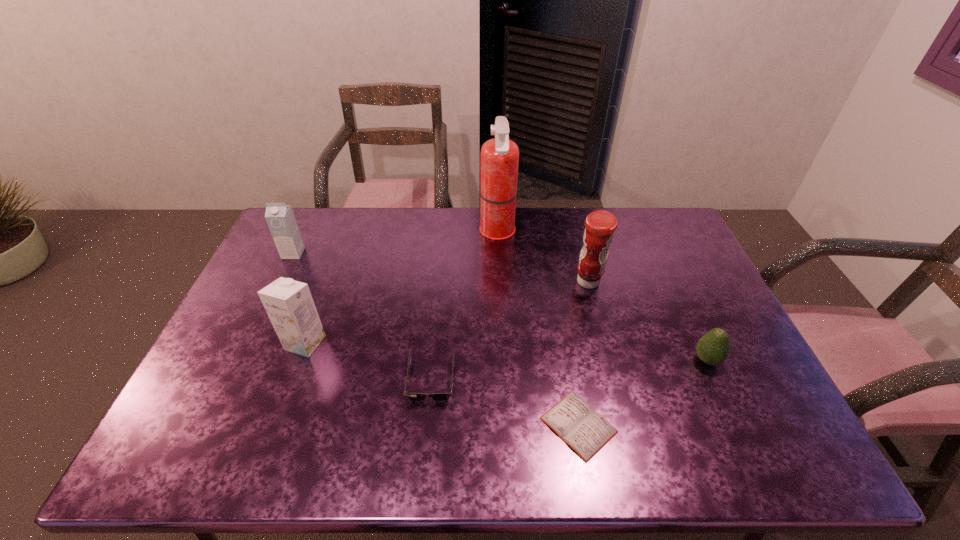
This screenshot has width=960, height=540. I want to click on object that stands as the closest to the third object from left to right, so click(x=586, y=431).

This screenshot has height=540, width=960. I want to click on object that stands as the second closest to the rightmost object, so click(x=600, y=225).

You are a GUI agent. You are given a task and a screenshot of the screen. Output one action in this format:
    pyautogui.click(x=<x>, y=<y>)
    Task: Click on the blank area in the image that satisfies the following two spatial constraints: 1. with the handle and hose on the tallest object; 2. on the back side of the diary
    
    Given the screenshot: What is the action you would take?
    pyautogui.click(x=507, y=425)

Where is `vacant space that satisfies the following two spatial constraints: 1. on the temples of the second shortest object; 2. on the right side of the diary`? This screenshot has width=960, height=540. vacant space that satisfies the following two spatial constraints: 1. on the temples of the second shortest object; 2. on the right side of the diary is located at coordinates (427, 425).

Identify the location of vacant position in the image that satisfies the following two spatial constraints: 1. on the front label of the shortest object; 2. on the right side of the left carton. The image size is (960, 540). (211, 425).

The height and width of the screenshot is (540, 960). Identify the location of vacant space that satisfies the following two spatial constraints: 1. with the handle and hose on the tallest object; 2. on the temples of the second shortest object. (505, 381).